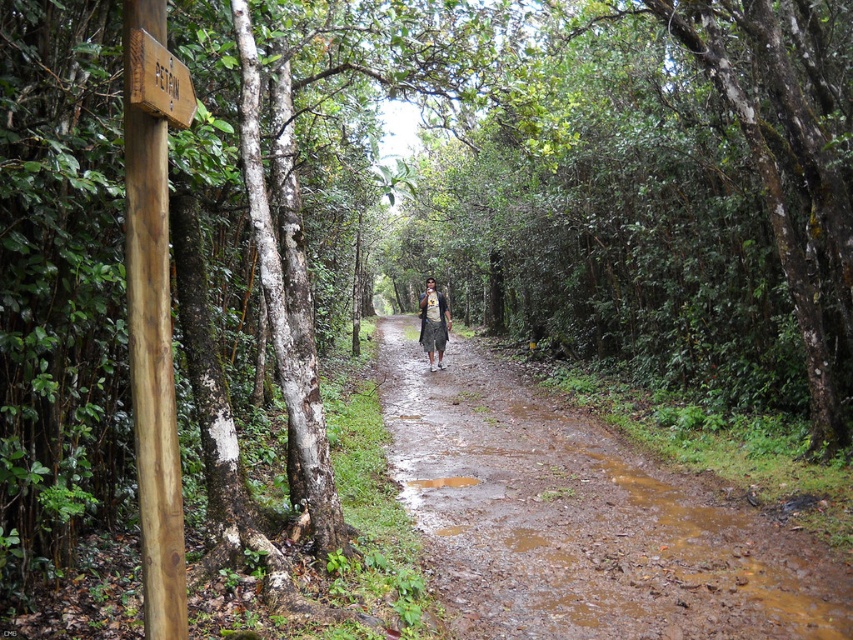
Question: Which point is closer to the camera?

Choices:
 (A) (158, 385)
 (B) (437, 348)

Answer: (A)

Question: Which object appears farthest from the camera in this image?

Choices:
 (A) camouflage fabric shirt at center
 (B) brown wooden signpost at left
 (C) muddy dirt path at center

Answer: (A)

Question: Is muddy dirt path at center bigger than camouflage fabric shirt at center?

Choices:
 (A) no
 (B) yes

Answer: (B)

Question: Is muddy dirt path at center positioned behind brown wooden signpost at left?

Choices:
 (A) yes
 (B) no

Answer: (A)

Question: Which object appears closest to the camera in this image?

Choices:
 (A) camouflage fabric shirt at center
 (B) brown wooden signpost at left

Answer: (B)

Question: Can you confirm if muddy dirt path at center is bigger than camouflage fabric shirt at center?

Choices:
 (A) no
 (B) yes

Answer: (B)